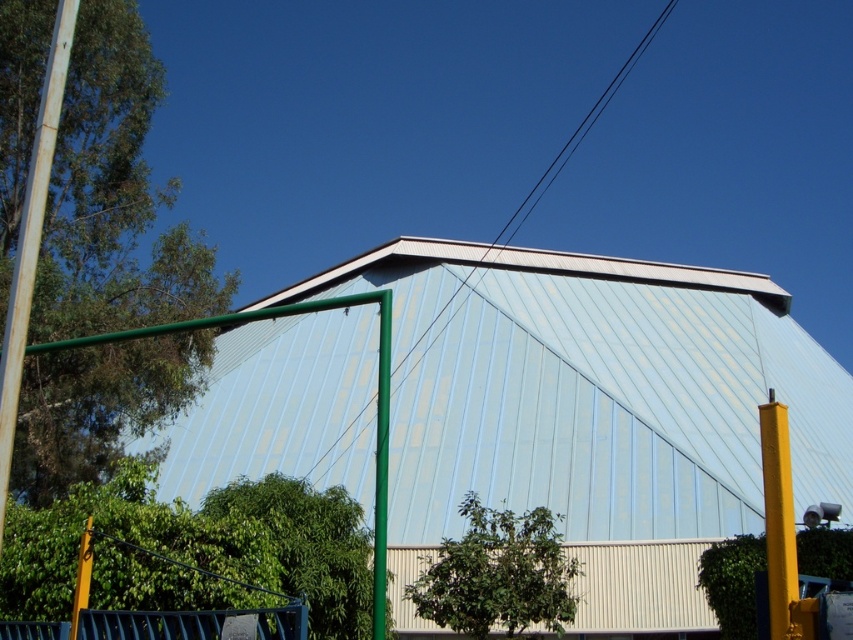
Question: Which object is positioned farthest from the green matte pole at center?

Choices:
 (A) yellow metallic pole at right
 (B) yellow matte pole at lower left

Answer: (B)

Question: Can you confirm if yellow metallic pole at right is smaller than yellow matte pole at lower left?

Choices:
 (A) yes
 (B) no

Answer: (B)

Question: Which point is closer to the camera?

Choices:
 (A) (80, 536)
 (B) (375, 490)

Answer: (B)

Question: Is yellow metallic pole at right positioned behind green matte pole at center?

Choices:
 (A) no
 (B) yes

Answer: (A)

Question: Is smooth wire at upper center to the right of yellow matte pole at lower left from the viewer's perspective?

Choices:
 (A) no
 (B) yes

Answer: (B)

Question: Estimate the real-world distances between objects in this image. Which object is farther from the green matte pole at center?

Choices:
 (A) yellow matte pole at lower left
 (B) yellow metallic pole at right
 (C) smooth wire at upper center

Answer: (C)